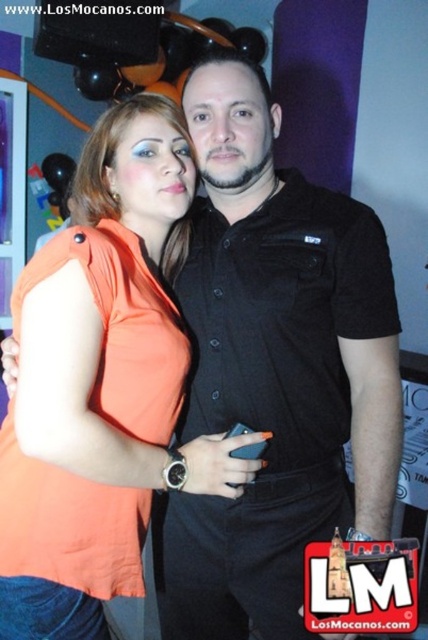
What are the coordinates of the black matte shirt at center?

The coordinates of the black matte shirt at center are point (275, 369).

You are a photographer at a social event. You need to capture a photo where the black matte shirt at center and orange fabric dress at center are both visible. Based on their heights, which object should be placed closer to the camera to ensure both are fully visible in the frame?

The black matte shirt at center is much taller than the orange fabric dress at center, so to ensure both are fully visible, the orange fabric dress at center should be placed closer to the camera.

You are standing in front of the scene and want to know which of the two points, point (x=187, y=401) or point (x=125, y=310), is closer to you. Can you determine this based on their positions?

Point (x=125, y=310) is closer to you because it is less further to the camera than point (x=187, y=401).